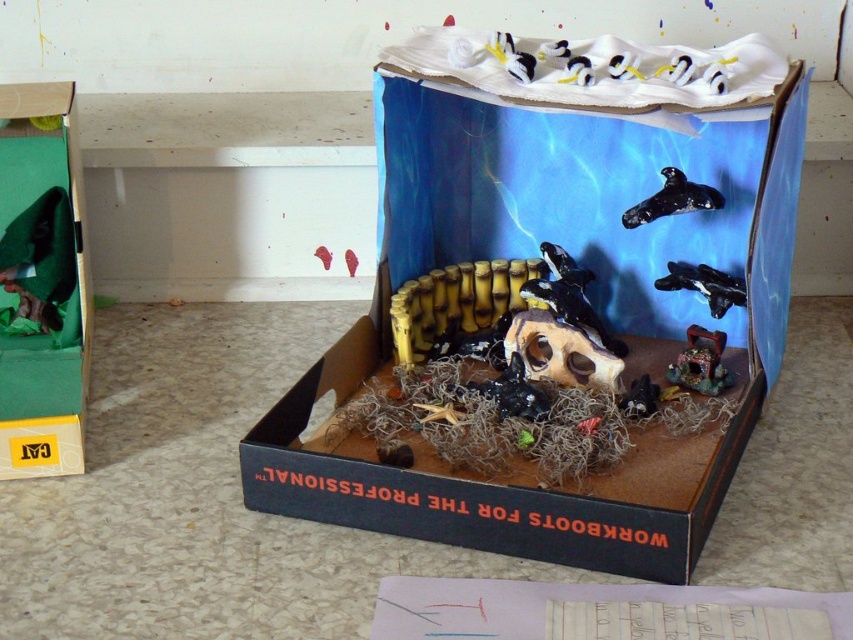
You are an observer looking into the diorama box. There are two points marked inside the box at coordinates point (338, 339) and point (567, 276). Which point is closer to you as you look into the box?

Point (567, 276) is closer to you because it is in front of point (338, 339).

You are an observer looking into the cardboard box diorama. You see the black rubber whale at upper center and the white glossy penguin at upper center. Which object is positioned lower in the scene?

The black rubber whale at upper center is located below the white glossy penguin at upper center, so it is positioned lower in the scene.